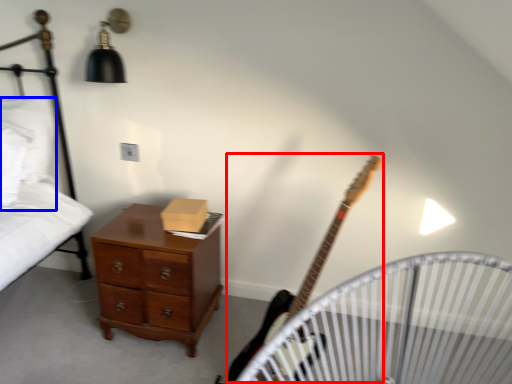
Question: Which object appears farthest to the camera in this image, guitar (highlighted by a red box) or pillow (highlighted by a blue box)?

Choices:
 (A) guitar
 (B) pillow

Answer: (B)